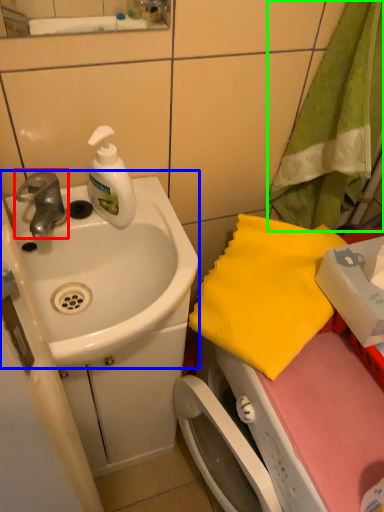
Question: Estimate the real-world distances between objects in this image. Which object is farther from tap (highlighted by a red box), sink (highlighted by a blue box) or beach towel (highlighted by a green box)?

Choices:
 (A) sink
 (B) beach towel

Answer: (B)